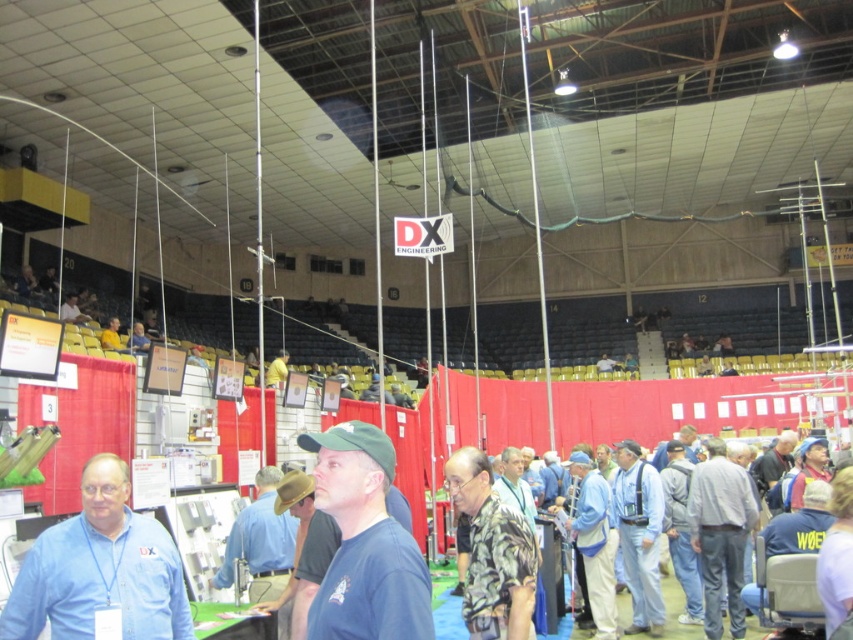
Question: Can you confirm if gray cotton shirt at lower right is smaller than yellow fabric at center?

Choices:
 (A) yes
 (B) no

Answer: (A)

Question: Which is nearer to the blue denim jacket at center?

Choices:
 (A) blue denim jeans at lower right
 (B) matte green cap at center

Answer: (A)

Question: Considering the real-world distances, which object is farthest from the matte green cap at center?

Choices:
 (A) gray cotton shirt at lower right
 (B) blue denim jacket at center
 (C) gray fabric jacket at center

Answer: (C)

Question: Is the position of blue denim jeans at lower right less distant than that of gray fabric jacket at center?

Choices:
 (A) no
 (B) yes

Answer: (B)

Question: Estimate the real-world distances between objects in this image. Which object is farther from the blue denim jacket at center?

Choices:
 (A) gray cotton shirt at lower right
 (B) yellow fabric at center
 (C) gray fabric jacket at center

Answer: (B)

Question: Does blue denim jeans at lower right have a smaller size compared to yellow fabric at center?

Choices:
 (A) yes
 (B) no

Answer: (A)